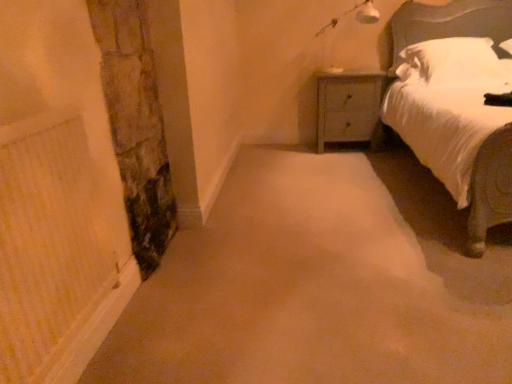
Question: Is wooden nightstand at upper right wider than white plastic lamp at upper right?

Choices:
 (A) yes
 (B) no

Answer: (A)

Question: Is wooden nightstand at upper right oriented away from white plastic lamp at upper right?

Choices:
 (A) yes
 (B) no

Answer: (B)

Question: Is there a large distance between wooden nightstand at upper right and white plastic lamp at upper right?

Choices:
 (A) no
 (B) yes

Answer: (A)

Question: Considering the relative sizes of wooden nightstand at upper right and white plastic lamp at upper right in the image provided, is wooden nightstand at upper right thinner than white plastic lamp at upper right?

Choices:
 (A) yes
 (B) no

Answer: (B)

Question: Is wooden nightstand at upper right located outside white plastic lamp at upper right?

Choices:
 (A) yes
 (B) no

Answer: (A)

Question: Choose the correct answer: Is white satin bed at upper right inside white soft pillow at upper right or outside it?

Choices:
 (A) outside
 (B) inside

Answer: (A)

Question: From the image's perspective, is white satin bed at upper right above or below white soft pillow at upper right?

Choices:
 (A) below
 (B) above

Answer: (A)

Question: Looking at their shapes, would you say white satin bed at upper right is wider or thinner than white soft pillow at upper right?

Choices:
 (A) thin
 (B) wide

Answer: (B)

Question: From a real-world perspective, is white satin bed at upper right physically located above or below white soft pillow at upper right?

Choices:
 (A) above
 (B) below

Answer: (B)

Question: Is stone textured pillar at left spatially inside white satin bed at upper right, or outside of it?

Choices:
 (A) inside
 (B) outside

Answer: (B)

Question: From their relative heights in the image, would you say stone textured pillar at left is taller or shorter than white satin bed at upper right?

Choices:
 (A) tall
 (B) short

Answer: (B)

Question: From a real-world perspective, is stone textured pillar at left above or below white satin bed at upper right?

Choices:
 (A) above
 (B) below

Answer: (B)

Question: Considering the relative positions of stone textured pillar at left and white satin bed at upper right in the image provided, is stone textured pillar at left to the left or to the right of white satin bed at upper right?

Choices:
 (A) left
 (B) right

Answer: (A)

Question: Based on their positions, is wooden nightstand at upper right located to the left or right of white plastic lamp at upper right?

Choices:
 (A) left
 (B) right

Answer: (B)

Question: From the image's perspective, relative to white plastic lamp at upper right, is wooden nightstand at upper right above or below?

Choices:
 (A) below
 (B) above

Answer: (A)